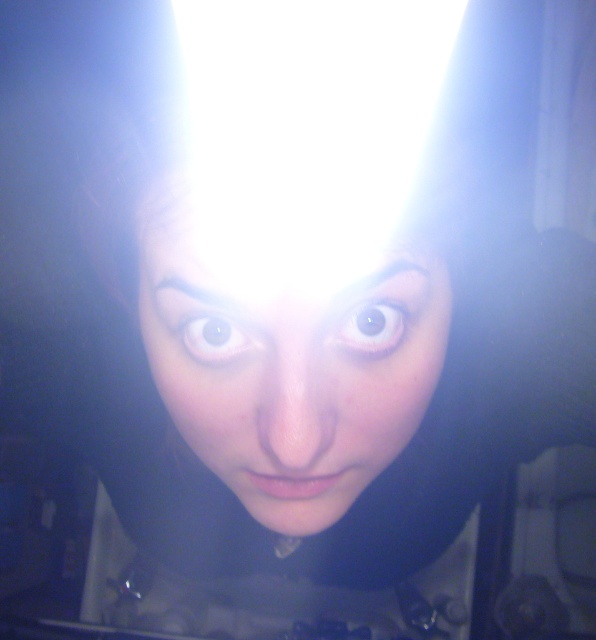
Who is more distant from viewer, (374, 342) or (193, 348)?

The point (193, 348) is behind.

Is point (378, 340) positioned after point (200, 326)?

Yes.

The width and height of the screenshot is (596, 640). Identify the location of brown glossy eye at center. (371, 326).

Which of these two, smooth skin face at center or brown glossy eye at upper center, stands taller?

smooth skin face at center is taller.

Does smooth skin face at center have a lesser width compared to brown glossy eye at upper center?

No, smooth skin face at center is not thinner than brown glossy eye at upper center.

Does point (138, 220) come in front of point (190, 348)?

No, it is behind (190, 348).

The height and width of the screenshot is (640, 596). I want to click on smooth skin face at center, so click(x=285, y=352).

Does smooth skin face at center have a smaller size compared to brown glossy eye at center?

No, smooth skin face at center is not smaller than brown glossy eye at center.

Who is positioned more to the right, smooth skin face at center or brown glossy eye at center?

Positioned to the right is brown glossy eye at center.

Who is more forward, [296,353] or [392,305]?

Positioned in front is point [296,353].

Where is `smooth skin face at center`? The height and width of the screenshot is (640, 596). smooth skin face at center is located at coordinates (285, 352).